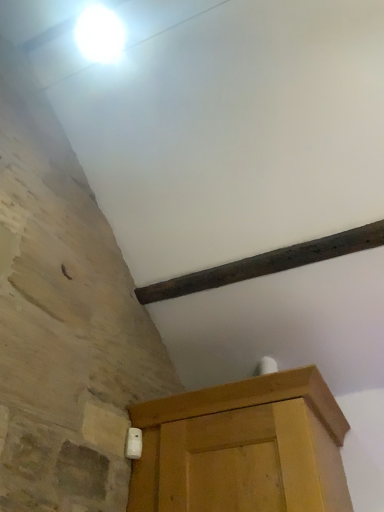
Identify the location of white glossy light at upper center. (99, 34).

The image size is (384, 512). What do you see at coordinates (99, 34) in the screenshot? I see `white glossy light at upper center` at bounding box center [99, 34].

Measure the distance between white glossy light at upper center and camera.

white glossy light at upper center and camera are 1.66 meters apart from each other.

Find the location of a particular element. The width and height of the screenshot is (384, 512). white glossy light at upper center is located at coordinates click(x=99, y=34).